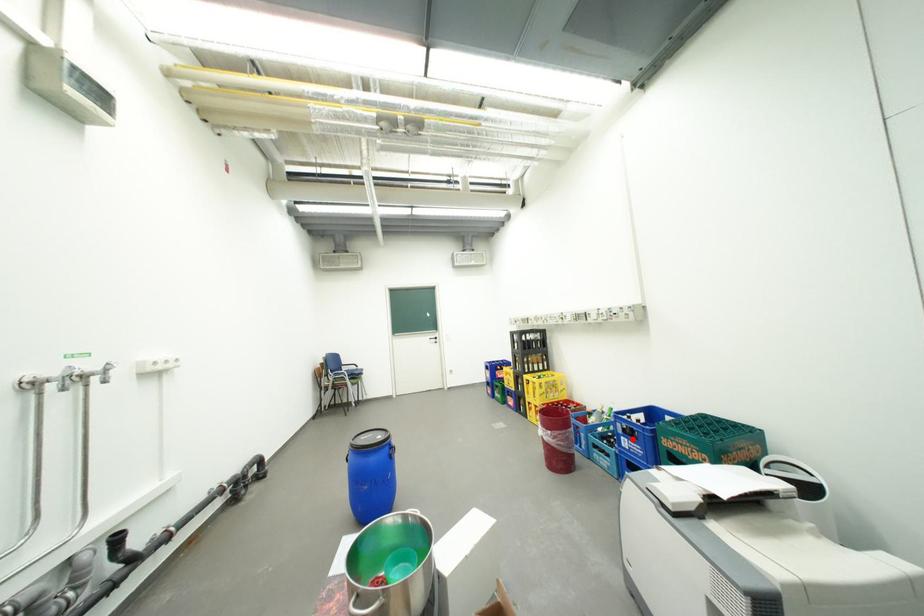
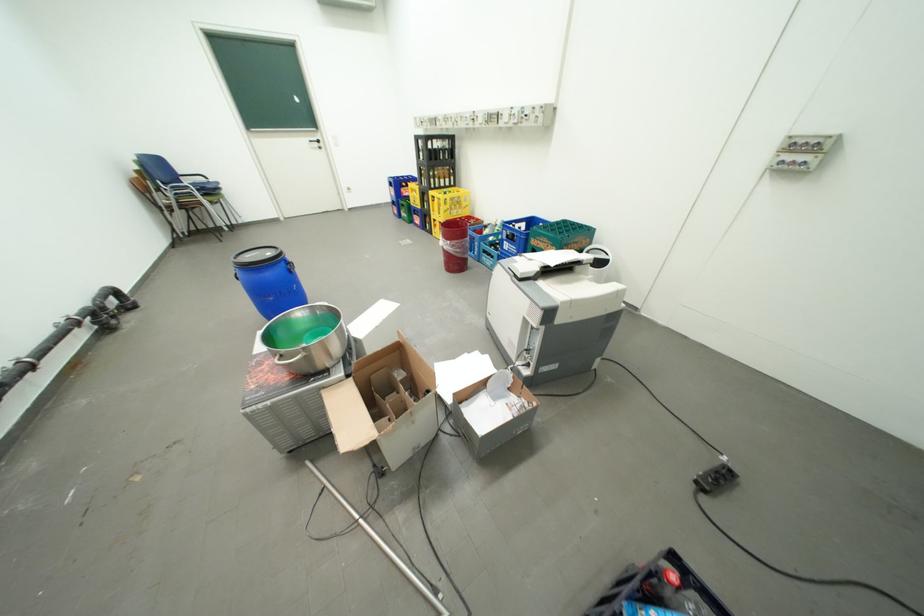
The point at the highlighted location is marked in the first image. Where is the corresponding point in the second image?

(516, 244)